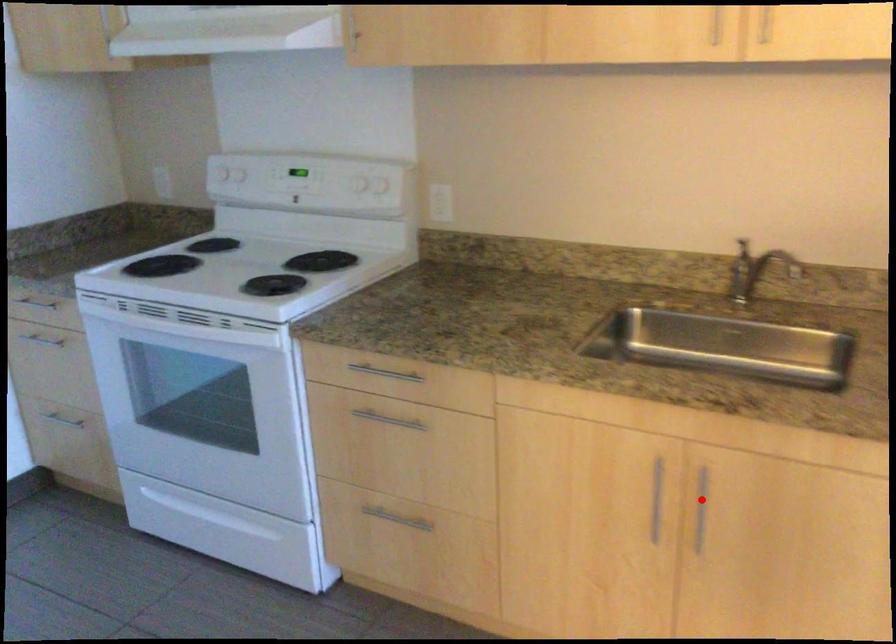
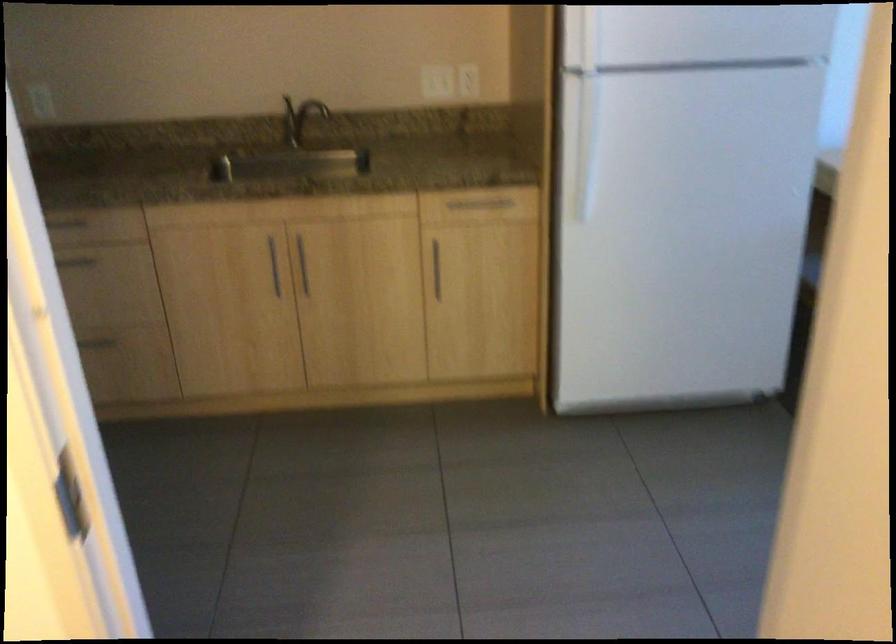
Question: I am providing you with two images of the same scene from different viewpoints. Image1 has a red point marked. In image2, the corresponding 3D location appears at what relative position? Reply with the corresponding letter.

Choices:
 (A) Closer
 (B) Farther

Answer: (B)